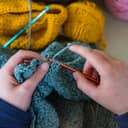
At what (x,y) coordinates should I click in order to perform the action: click on beige surface. Please return your answer as a coordinate pair (x, y). Looking at the image, I should click on (119, 38).